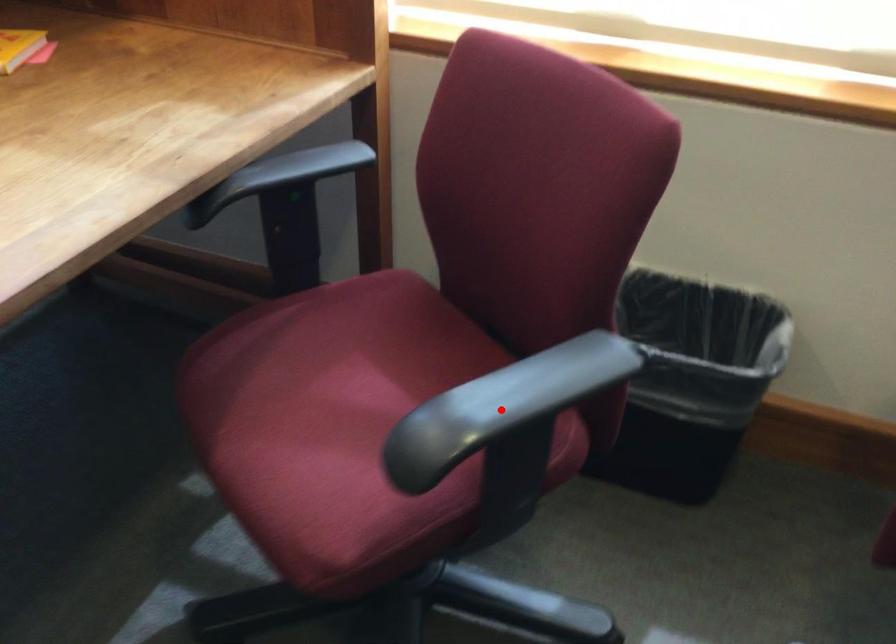
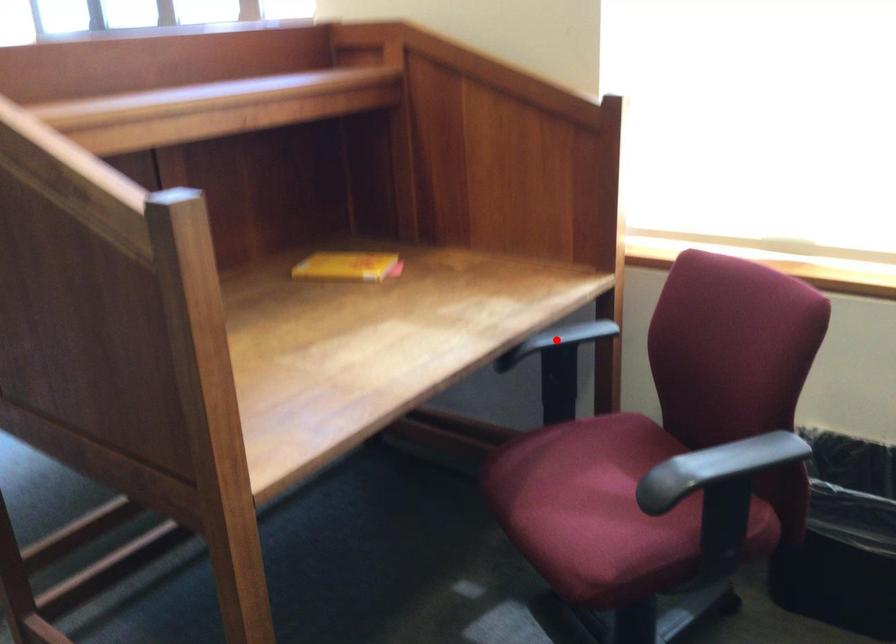
I am providing you with two images of the same scene from different viewpoints. A red point is marked on the first image and another point is marked on the second image. Is the red point in image1 aligned with the point shown in image2?

No